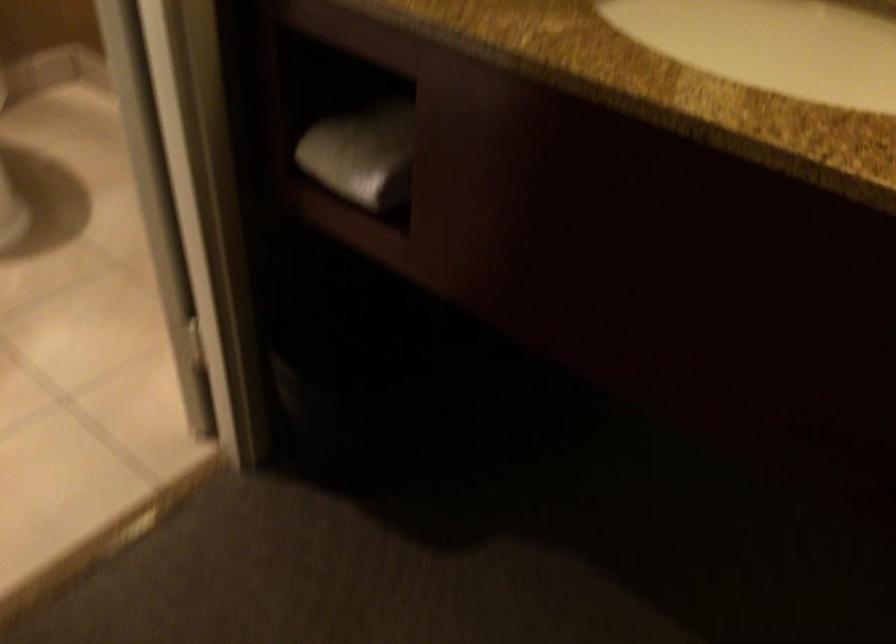
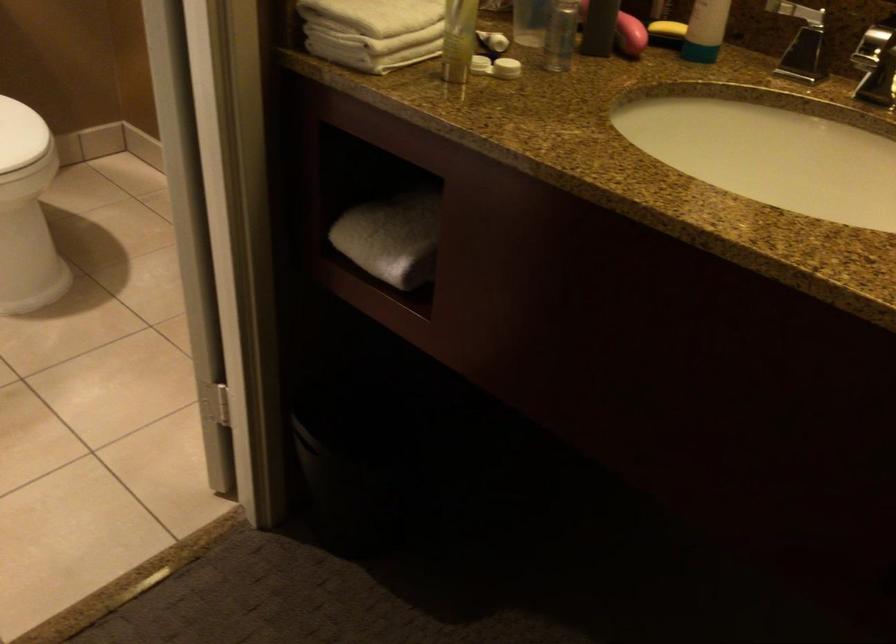
In the second image, find the point that corresponds to point 362,154 in the first image.

(392, 238)